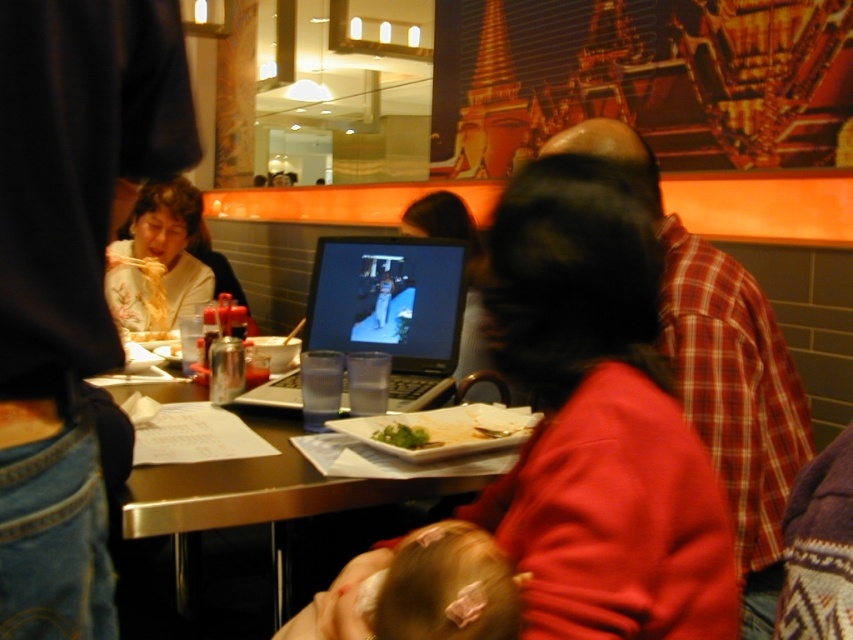
Question: Which of these objects is positioned farthest from the silver metallic laptop at center?

Choices:
 (A) metallic table at center
 (B) green leafy vegetable at center

Answer: (B)

Question: Which point is farther from the camera taking this photo?

Choices:
 (A) (511, 227)
 (B) (222, 467)
 (C) (375, 445)
 (D) (773, 474)

Answer: (D)

Question: Does white paper plate at center appear under green leafy vegetable at center?

Choices:
 (A) yes
 (B) no

Answer: (B)

Question: Based on their relative distances, which object is nearer to the silver metallic laptop at center?

Choices:
 (A) matte red sweater at center
 (B) green leafy vegetable at center

Answer: (B)

Question: In this image, where is matte black laptop at left located relative to plaid shirt at center?

Choices:
 (A) right
 (B) left

Answer: (B)

Question: Can you confirm if silver metallic laptop at center is bigger than white paper plate at center?

Choices:
 (A) no
 (B) yes

Answer: (B)